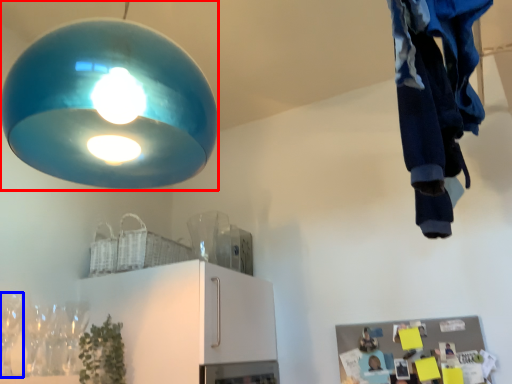
Question: Which point is closer to the camera, lamp (highlighted by a red box) or wine glass (highlighted by a blue box)?

Choices:
 (A) lamp
 (B) wine glass

Answer: (A)